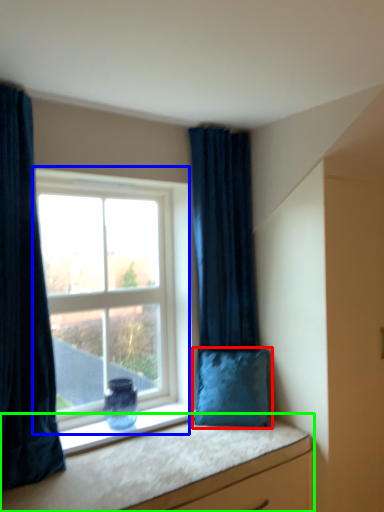
Question: Which object is positioned closest to pillow (highlighted by a red box)? Select from window (highlighted by a blue box) and vanity (highlighted by a green box).

Choices:
 (A) window
 (B) vanity

Answer: (B)